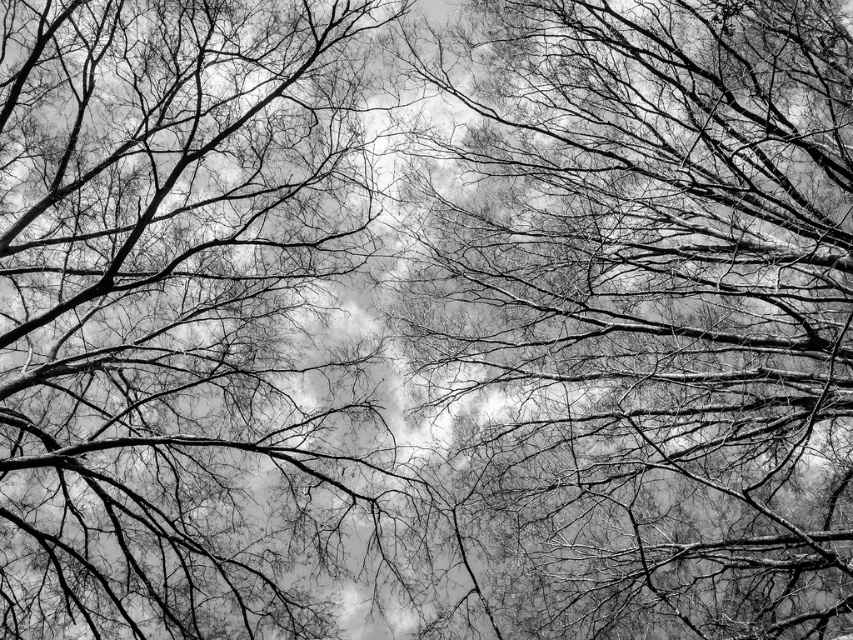
You are an artist planning to sketch this scene. You want to focus on the smooth bark tree at center and silhouette branches at center. Which object should you draw first if you want to emphasize its smaller width compared to the other?

You should draw the smooth bark tree at center first because its width is smaller than the silhouette branches at center, allowing you to establish the narrower element before adding the wider branches.

Consider the image. You are a photographer standing below a dense canopy of bare tree branches. You notice a specific point at coordinates point (662, 292). What object is located at this point?

The point (662, 292) corresponds to the smooth bark tree at center.

You are standing under the dense canopy of bare tree branches in the image. You want to locate the smooth bark tree at center. Based on its coordinates, where should you look relative to your current position?

The smooth bark tree at center is located at coordinates point [662,292], which means it is positioned slightly to the right and upwards from your current position under the canopy.